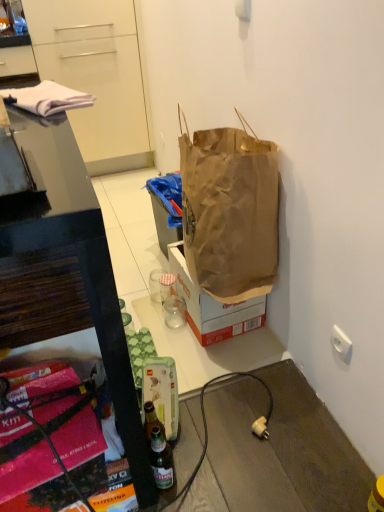
Question: Would you say white plastic power outlet at lower right is inside or outside transparent glass at center, arranged as the second coffee cup when viewed from the back?

Choices:
 (A) outside
 (B) inside

Answer: (A)

Question: From the image's perspective, is white plastic power outlet at lower right above or below transparent glass at center, arranged as the second coffee cup when viewed from the back?

Choices:
 (A) below
 (B) above

Answer: (A)

Question: Which object is the closest to the brown paper bag at center?

Choices:
 (A) white cloth at upper left
 (B) white glossy cabinet at upper left
 (C) transparent glass at center, positioned as the first coffee cup in front-to-back order
 (D) brown paper bag at center
 (E) clear glass cup at center, which is counted as the first coffee cup, starting from the back

Answer: (D)

Question: Based on their relative distances, which object is nearer to the clear glass cup at center, which appears as the second coffee cup when viewed from the front?

Choices:
 (A) brown paper bag at center
 (B) white glossy cabinet at upper left
 (C) brown paper bag at center
 (D) white cloth at upper left
 (E) transparent glass at center, positioned as the first coffee cup in front-to-back order

Answer: (E)